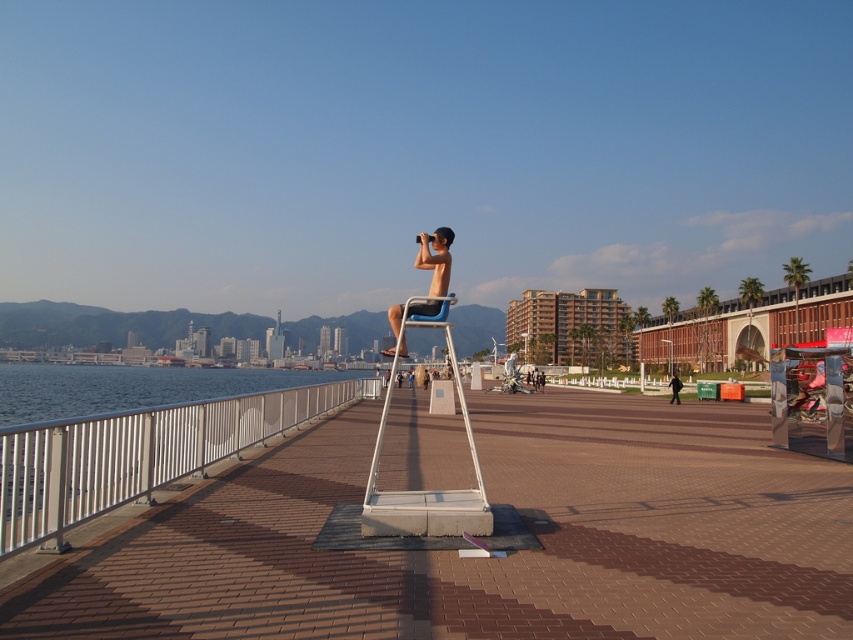
Is silver metallic railing at left shorter than white plastic ladder at center?

Yes.

Who is positioned more to the left, silver metallic railing at left or white plastic ladder at center?

Positioned to the left is silver metallic railing at left.

Who is more distant from viewer, (78, 454) or (407, 528)?

The point (407, 528) is more distant.

This screenshot has height=640, width=853. What are the coordinates of `silver metallic railing at left` in the screenshot? It's located at (136, 454).

Which is above, white plastic ladder at center or black fabric person at center?

white plastic ladder at center is above.

Does white plastic ladder at center lie behind black fabric person at center?

That is False.

Which is in front, point (451, 500) or point (669, 381)?

Point (451, 500) is more forward.

At what (x,y) coordinates should I click in order to perform the action: click on white plastic ladder at center. Please return your answer as a coordinate pair (x, y). Looking at the image, I should click on (426, 490).

Is the position of silver metallic railing at left less distant than that of black fabric person at center?

Yes, it is.

Between point (245, 413) and point (682, 385), which one is positioned behind?

Positioned behind is point (682, 385).

You are a GUI agent. You are given a task and a screenshot of the screen. Output one action in this format:
    pyautogui.click(x=<x>, y=<y>)
    Task: Click on the silver metallic railing at left
    This screenshot has height=640, width=853.
    Given the screenshot: What is the action you would take?
    pyautogui.click(x=136, y=454)